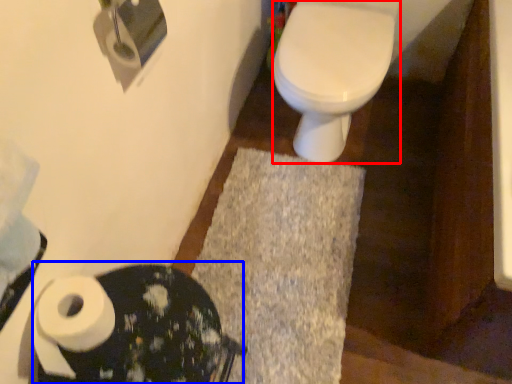
Question: Which of the following is the closest to the observer, bidet (highlighted by a red box) or porcelain (highlighted by a blue box)?

Choices:
 (A) bidet
 (B) porcelain

Answer: (B)